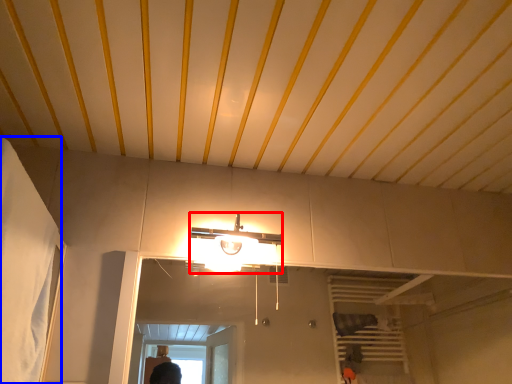
Question: Which object is further to the camera taking this photo, light fixture (highlighted by a red box) or curtain (highlighted by a blue box)?

Choices:
 (A) light fixture
 (B) curtain

Answer: (A)